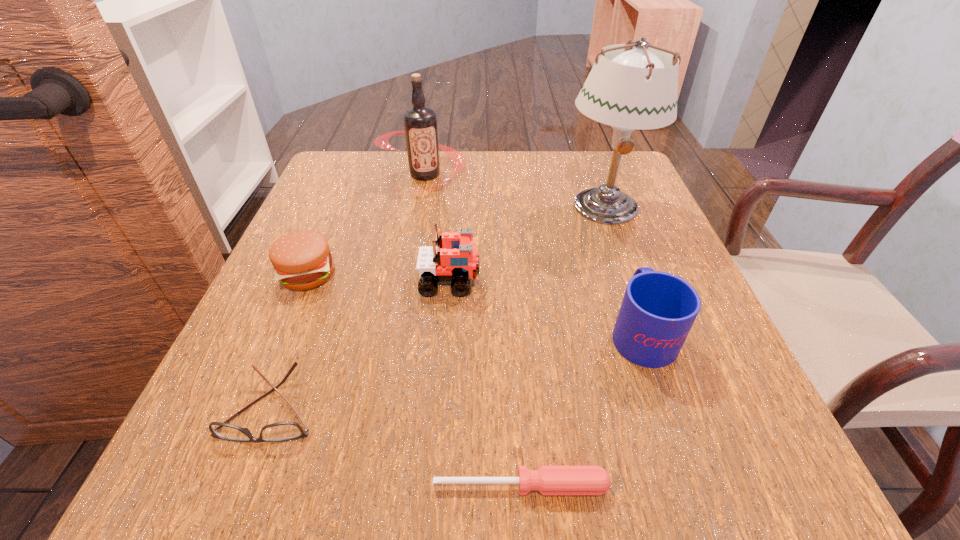
You are a GUI agent. You are given a task and a screenshot of the screen. Output one action in this format:
    pyautogui.click(x=<x>, y=<y>)
    Task: Click on the empty location between the third shortest object and the third nearest object
    The height and width of the screenshot is (540, 960).
    Given the screenshot: What is the action you would take?
    pyautogui.click(x=474, y=303)

Locate an element on the screen. The image size is (960, 540). vacant space in between the fifth farthest object and the second nearest object is located at coordinates (457, 369).

Where is `free space that is in between the lampshade and the third nearest object`? The width and height of the screenshot is (960, 540). free space that is in between the lampshade and the third nearest object is located at coordinates (623, 269).

This screenshot has height=540, width=960. What are the coordinates of `free space between the root beer and the fifth tallest object` in the screenshot? It's located at (367, 224).

Locate an element on the screen. The image size is (960, 540). object that is the second closest one to the Lego is located at coordinates (281, 431).

Select which object is the fifth closest to the shortest object. Please provide its 2D coordinates. Your answer should be formatted as a tuple, i.e. [(x, y)], where the tuple contains the x and y coordinates of a point satisfying the conditions above.

[(637, 89)]

Identify the location of vacant area that satisfies the following two spatial constraints: 1. on the front-facing side of the Lego; 2. on the front-facing side of the spectacles. The width and height of the screenshot is (960, 540). (441, 407).

Identify the location of free region that satisfies the following two spatial constraints: 1. on the back side of the shortest object; 2. on the front-facing side of the Lego. The image size is (960, 540). [x=507, y=281].

This screenshot has width=960, height=540. Find the location of `vacant space that satisfies the following two spatial constraints: 1. on the front-facing side of the Lego; 2. on the right side of the nearest object`. vacant space that satisfies the following two spatial constraints: 1. on the front-facing side of the Lego; 2. on the right side of the nearest object is located at coordinates (435, 485).